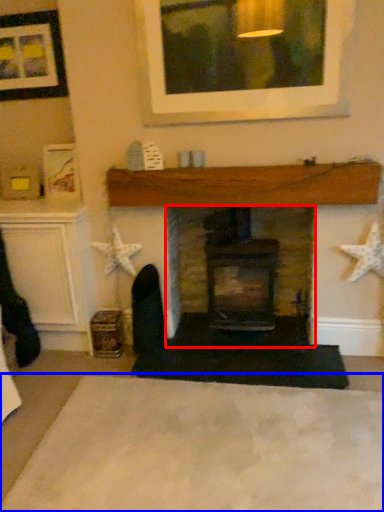
Question: Which object is further to the camera taking this photo, fireplace (highlighted by a red box) or plain (highlighted by a blue box)?

Choices:
 (A) fireplace
 (B) plain

Answer: (A)